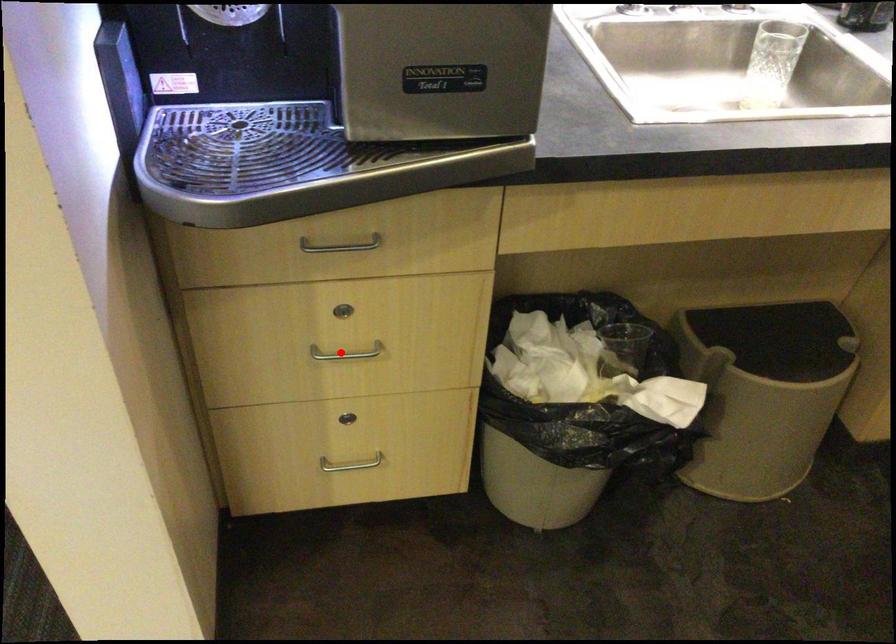
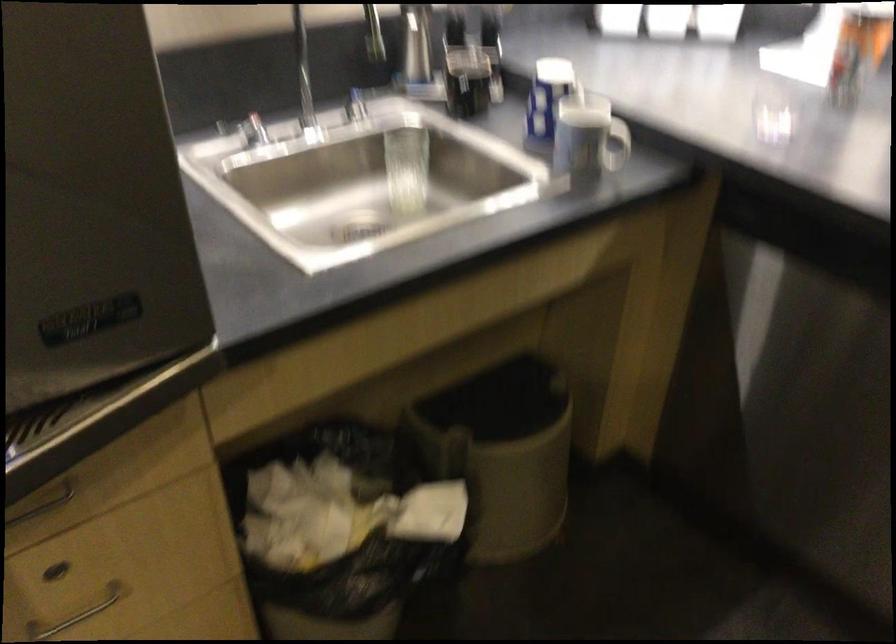
Question: I am providing you with two images of the same scene from different viewpoints. Given a red point in image1, look at the same physical point in image2. Is it:

Choices:
 (A) Closer to the viewpoint
 (B) Farther from the viewpoint

Answer: (A)